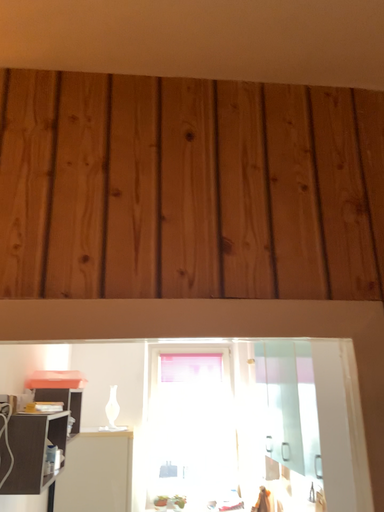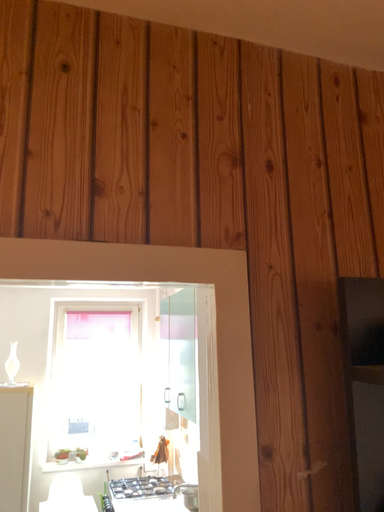
Question: How did the camera likely rotate when shooting the video?

Choices:
 (A) rotated right
 (B) rotated left

Answer: (A)